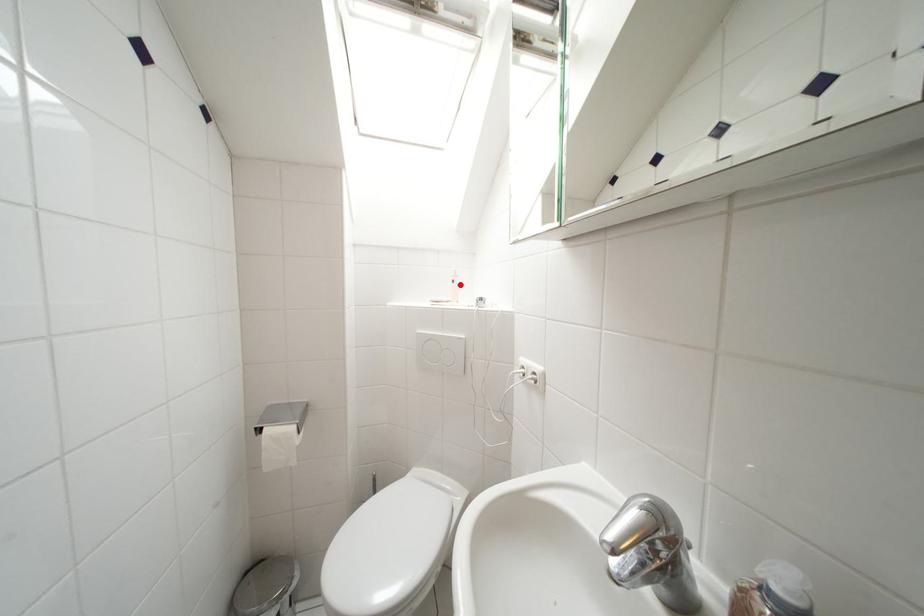
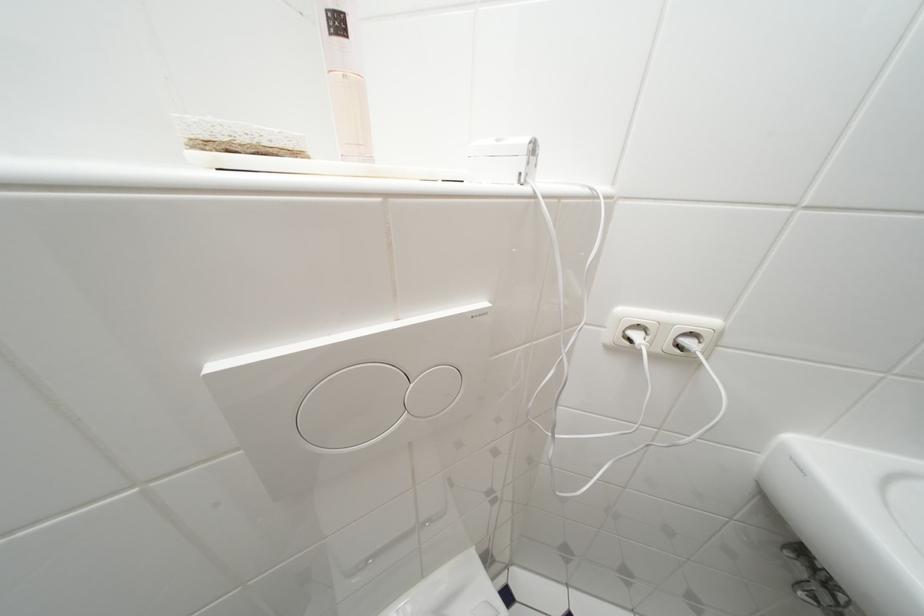
In the second image, find the point that corresponds to the highlighted location in the first image.

(345, 26)